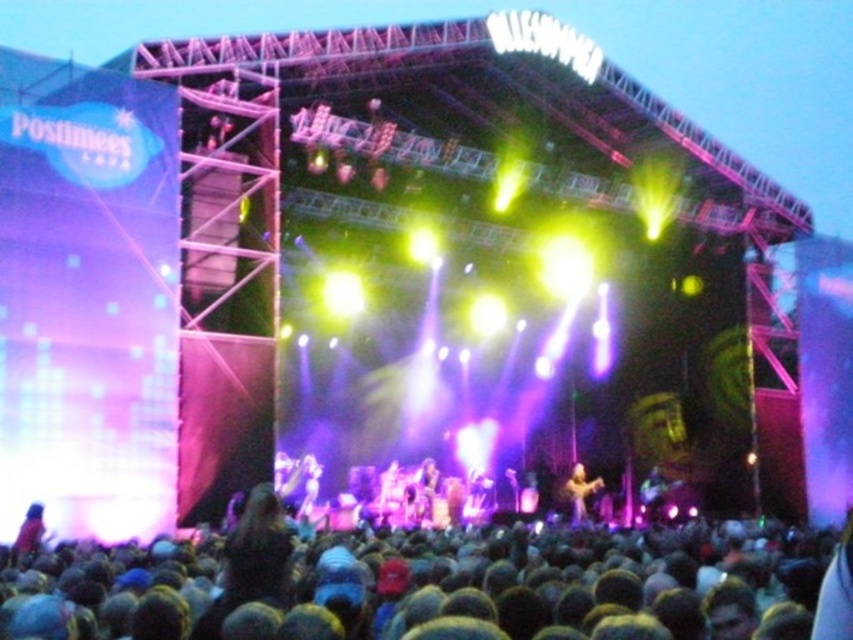
You are standing at the front of the concert stage and want to know how far the point marked at coordinates point (195,627) is from you. Can you determine the distance?

The distance between you and point (195,627) is 145.07 feet.

You are a photographer standing at the edge of the concert crowd. You want to take a clear photo of the shiny gold guitar at center from your current position. Considering the distance, will you be able to capture it in focus without moving closer?

The shiny gold guitar at center is 86.68 meters away from the viewer. At this distance, capturing it in focus without moving closer would be extremely challenging unless using specialized equipment with a very long focal length lens. Most standard cameras may struggle to achieve sharp focus at such a distance.

You are a photographer at the concert and want to capture the shiny black guitar at center in your shot. The camera is currently focused on the stage backdrop. To adjust the focus to the guitar, should you move the focus point upwards or downwards? Please explain using the coordinates provided.

The coordinates of the shiny black guitar at center are at point (653,496). Since the y coordinate is 0.766, which is closer to 1.0 than 0.0, the guitar is located lower on the image. Therefore, to focus on it, you should move the focus point downwards from the backdrop towards the lower part of the image.